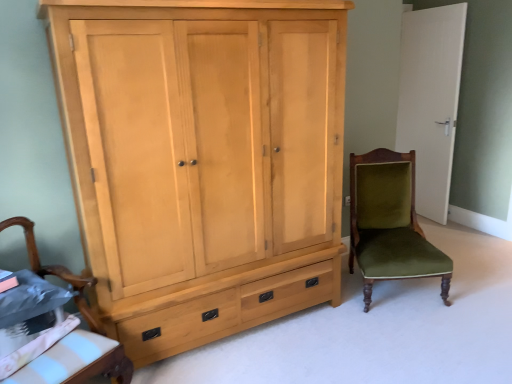
Find the location of `free location to the right of velvet green chair at right, the first chair when ordered from right to left`. free location to the right of velvet green chair at right, the first chair when ordered from right to left is located at coordinates (477, 280).